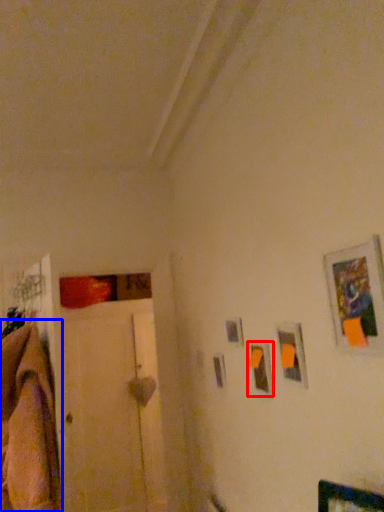
Question: Which object appears farthest to the camera in this image, picture frame (highlighted by a red box) or blanket (highlighted by a blue box)?

Choices:
 (A) picture frame
 (B) blanket

Answer: (A)